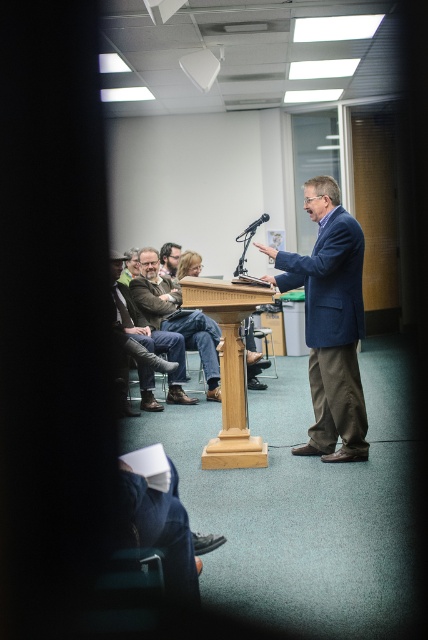
You are an event planner organizing a photoshoot in this presentation setting. You need to place a small decorative plant on the podium where the blue fabric suit at center is currently standing. Is there enough space for the plant without moving the speaker?

The blue fabric suit at center is located at point (329,323), which indicates it is positioned centrally on the podium. Since the podium typically has enough space for a speaker and small items like a plant, there should be sufficient room to place the plant without displacing the speaker.

You are sitting in the front row of the audience and notice two items of interest in the scene. One is a brown leather jacket at left and the other is matte brown hair at center. Which item is positioned lower in the image?

The brown leather jacket at left is located below matte brown hair at center, so it is positioned lower in the image.

You are an event coordinator planning to seat guests for a photo. You need to arrange two attendees based on their clothing. The blue fabric suit at center and the brown leather jacket at left are present. Which attendee should you place closer to the camera to ensure their full height is visible?

The blue fabric suit at center should be placed closer to the camera because it is taller than the brown leather jacket at left, ensuring their full height is visible.